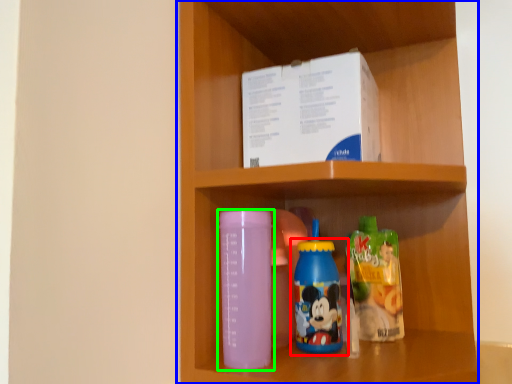
Question: Estimate the real-world distances between objects in this image. Which object is farther from bottle (highlighted by a red box), shelf (highlighted by a blue box) or bottle (highlighted by a green box)?

Choices:
 (A) shelf
 (B) bottle

Answer: (A)